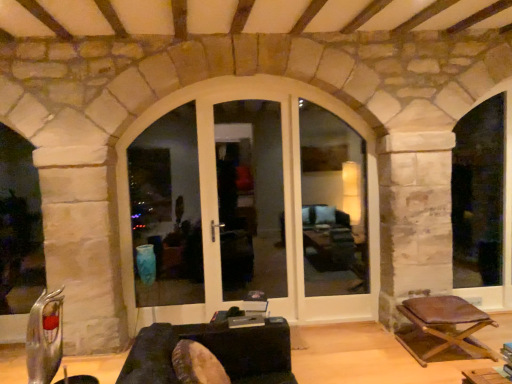
Identify the location of vacant area that lies to the right of white glossy door at center. This screenshot has width=512, height=384. (315, 339).